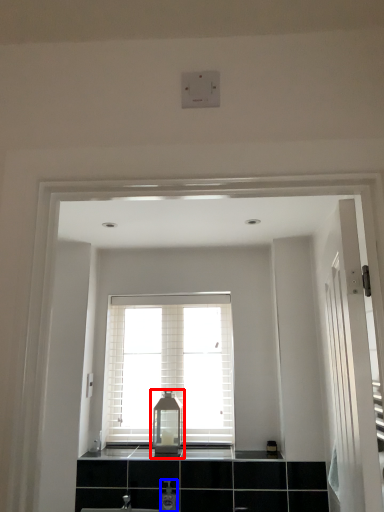
Question: Among these objects, which one is nearest to the camera, medicine cabinet (highlighted by a red box) or toiletry (highlighted by a blue box)?

Choices:
 (A) medicine cabinet
 (B) toiletry

Answer: (B)